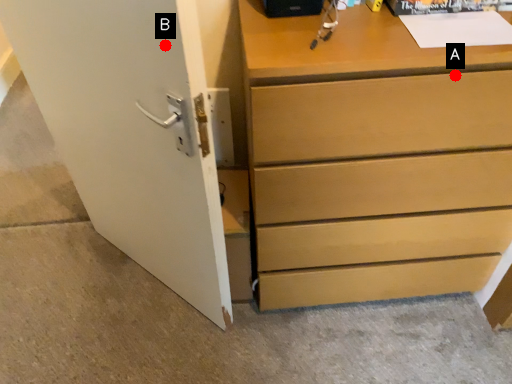
Question: Two points are circled on the image, labeled by A and B beside each circle. Which point is further to the camera?

Choices:
 (A) A is further
 (B) B is further

Answer: (A)